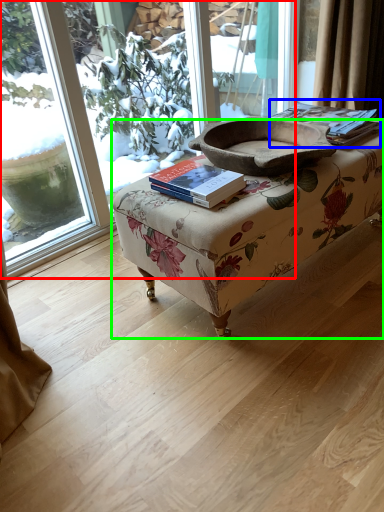
Question: Which object is positioned closest to window (highlighted by a red box)? Select from paperback book (highlighted by a blue box) and table (highlighted by a green box).

Choices:
 (A) paperback book
 (B) table

Answer: (A)